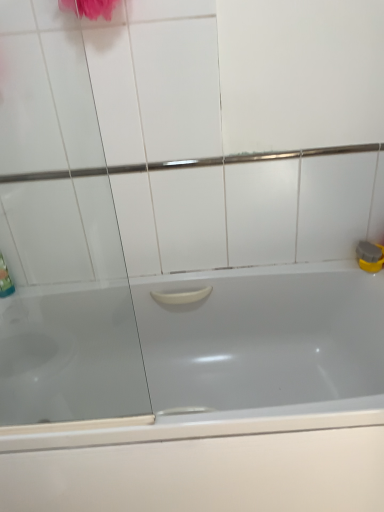
What is the approximate width of transparent glass screen door at left?

1.64 inches.

The image size is (384, 512). Describe the element at coordinates (60, 240) in the screenshot. I see `transparent glass screen door at left` at that location.

You are a GUI agent. You are given a task and a screenshot of the screen. Output one action in this format:
    pyautogui.click(x=<x>, y=<y>)
    Task: Click on the transparent glass screen door at left
    
    Given the screenshot: What is the action you would take?
    pyautogui.click(x=60, y=240)

Measure the distance between transparent glass screen door at left and camera.

transparent glass screen door at left is 29.86 inches from camera.

What do you see at coordinates (233, 403) in the screenshot? The image size is (384, 512). I see `white glossy bathtub at center` at bounding box center [233, 403].

The height and width of the screenshot is (512, 384). Find the location of `white glossy bathtub at center`. white glossy bathtub at center is located at coordinates [233, 403].

The width and height of the screenshot is (384, 512). Find the location of `transparent glass screen door at left`. transparent glass screen door at left is located at coordinates (60, 240).

Does white glossy bathtub at center appear on the right side of transparent glass screen door at left?

Correct, you'll find white glossy bathtub at center to the right of transparent glass screen door at left.

Between white glossy bathtub at center and transparent glass screen door at left, which one is positioned behind?

white glossy bathtub at center.

Which is in front, point (150, 487) or point (19, 5)?

The point (19, 5) is more forward.

From the image's perspective, is white glossy bathtub at center located beneath transparent glass screen door at left?

Correct, white glossy bathtub at center appears lower than transparent glass screen door at left in the image.

Consider the image. From a real-world perspective, which is physically below, white glossy bathtub at center or transparent glass screen door at left?

white glossy bathtub at center is physically lower.

Does white glossy bathtub at center have a greater width compared to transparent glass screen door at left?

Yes, white glossy bathtub at center is wider than transparent glass screen door at left.

Who is taller, white glossy bathtub at center or transparent glass screen door at left?

With more height is transparent glass screen door at left.

Can you confirm if white glossy bathtub at center is smaller than transparent glass screen door at left?

No, white glossy bathtub at center is not smaller than transparent glass screen door at left.

Would you say white glossy bathtub at center contains transparent glass screen door at left?

No, transparent glass screen door at left is not inside white glossy bathtub at center.

Is white glossy bathtub at center directly adjacent to transparent glass screen door at left?

No, white glossy bathtub at center is not beside transparent glass screen door at left.

Is white glossy bathtub at center looking in the opposite direction of transparent glass screen door at left?

No, white glossy bathtub at center's orientation is not away from transparent glass screen door at left.

How distant is white glossy bathtub at center from transparent glass screen door at left?

white glossy bathtub at center and transparent glass screen door at left are 17.34 inches apart.

I want to click on screen door that appears above the white glossy bathtub at center (from a real-world perspective), so click(60, 240).

Based on their positions, is transparent glass screen door at left located to the left or right of white glossy bathtub at center?

Based on their positions, transparent glass screen door at left is located to the left of white glossy bathtub at center.

Which object is further away from the camera taking this photo, transparent glass screen door at left or white glossy bathtub at center?

Positioned behind is white glossy bathtub at center.

Is point (92, 311) positioned behind point (372, 490)?

Yes, it is.

From the image's perspective, is transparent glass screen door at left located above white glossy bathtub at center?

Yes, from the image's perspective, transparent glass screen door at left is above white glossy bathtub at center.

From a real-world perspective, is transparent glass screen door at left over white glossy bathtub at center?

Yes, from a real-world perspective, transparent glass screen door at left is over white glossy bathtub at center

Considering the relative sizes of transparent glass screen door at left and white glossy bathtub at center in the image provided, is transparent glass screen door at left wider than white glossy bathtub at center?

No.

Considering the relative sizes of transparent glass screen door at left and white glossy bathtub at center in the image provided, is transparent glass screen door at left taller than white glossy bathtub at center?

Yes, transparent glass screen door at left is taller than white glossy bathtub at center.

Can you confirm if transparent glass screen door at left is smaller than white glossy bathtub at center?

Yes.

Choose the correct answer: Is transparent glass screen door at left inside white glossy bathtub at center or outside it?

transparent glass screen door at left is spatially situated outside white glossy bathtub at center.

Is the surface of transparent glass screen door at left in direct contact with white glossy bathtub at center?

No, transparent glass screen door at left is not with white glossy bathtub at center.

Is transparent glass screen door at left facing towards white glossy bathtub at center?

No.

How different are the orientations of transparent glass screen door at left and white glossy bathtub at center in degrees?

0.000455 degrees separate the facing orientations of transparent glass screen door at left and white glossy bathtub at center.

Where is `screen door in front of the white glossy bathtub at center`? This screenshot has width=384, height=512. screen door in front of the white glossy bathtub at center is located at coordinates (60, 240).

This screenshot has height=512, width=384. I want to click on bathtub below the transparent glass screen door at left (from the image's perspective), so click(x=233, y=403).

Image resolution: width=384 pixels, height=512 pixels. I want to click on screen door above the white glossy bathtub at center (from a real-world perspective), so click(60, 240).